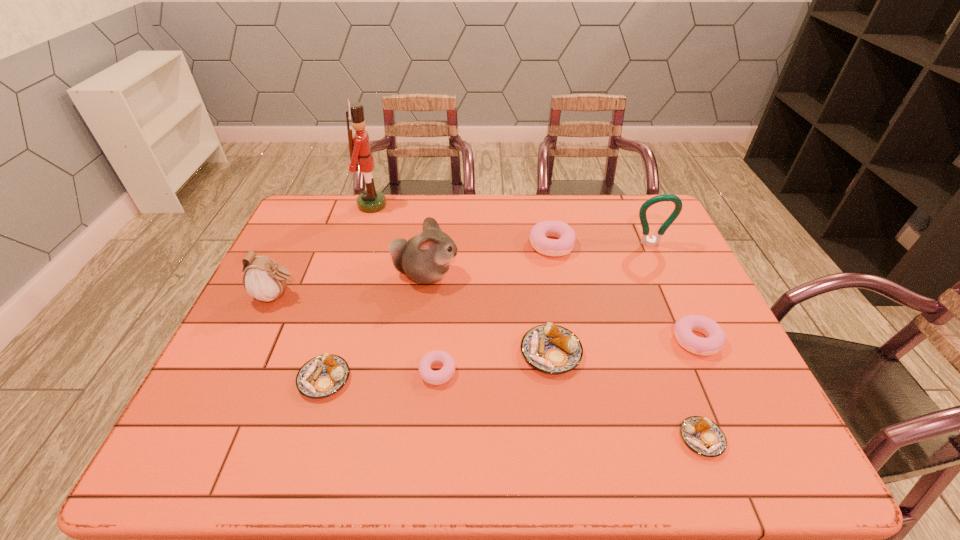
At what (x,y) coordinates should I click in order to perform the action: click on the farthest object. Please return your answer as a coordinate pair (x, y). This screenshot has width=960, height=540. Looking at the image, I should click on (369, 201).

Locate an element on the screen. The image size is (960, 540). green nutcracker is located at coordinates (369, 201).

Locate an element on the screen. The height and width of the screenshot is (540, 960). green bottle opener is located at coordinates point(653,241).

Where is `white hamster`? The height and width of the screenshot is (540, 960). white hamster is located at coordinates (425, 258).

Identify the location of the seventh shortest object. (264, 280).

Find the location of a particular element. This screenshot has height=540, width=960. pouch is located at coordinates (264, 280).

You are a GUI agent. You are given a task and a screenshot of the screen. Output one action in this format:
    pyautogui.click(x=<x>, y=<y>)
    Task: Click on the biggest pink pastry
    Image resolution: width=960 pixels, height=540 pixels.
    Given the screenshot: What is the action you would take?
    pyautogui.click(x=566, y=236)

This screenshot has height=540, width=960. In order to click on the farthest pink pastry in this screenshot , I will do `click(566, 236)`.

The width and height of the screenshot is (960, 540). Find the location of `the biggest brown pastry`. the biggest brown pastry is located at coordinates (549, 348).

Identify the location of the rightmost pink pastry. The image size is (960, 540). (683, 328).